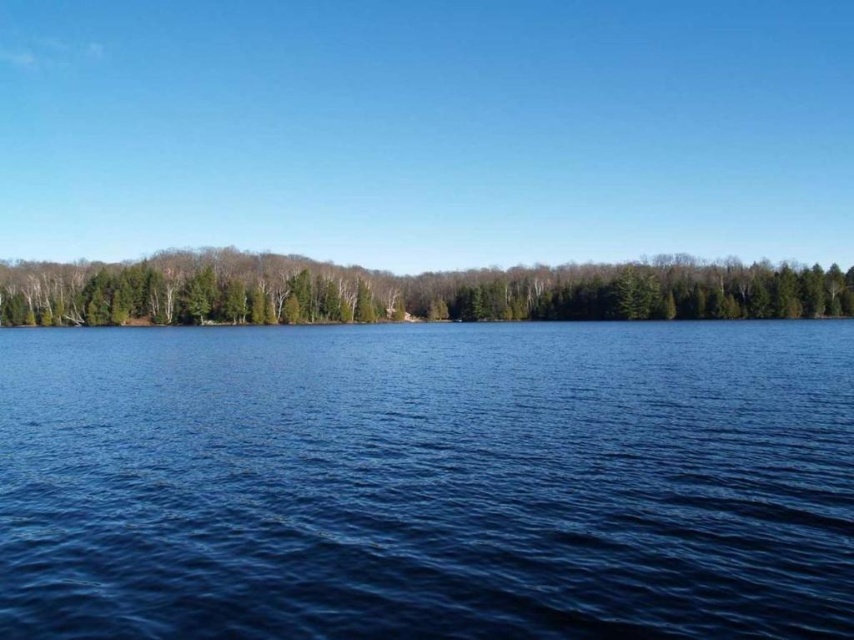
Question: Is deep blue water at center positioned in front of green matte trees at center?

Choices:
 (A) no
 (B) yes

Answer: (B)

Question: Which point is closer to the camera taking this photo?

Choices:
 (A) pyautogui.click(x=770, y=600)
 (B) pyautogui.click(x=512, y=305)

Answer: (A)

Question: Among these objects, which one is farthest from the camera?

Choices:
 (A) green matte trees at center
 (B) deep blue water at center

Answer: (A)

Question: Does deep blue water at center have a smaller size compared to green matte trees at center?

Choices:
 (A) yes
 (B) no

Answer: (A)

Question: Is deep blue water at center smaller than green matte trees at center?

Choices:
 (A) no
 (B) yes

Answer: (B)